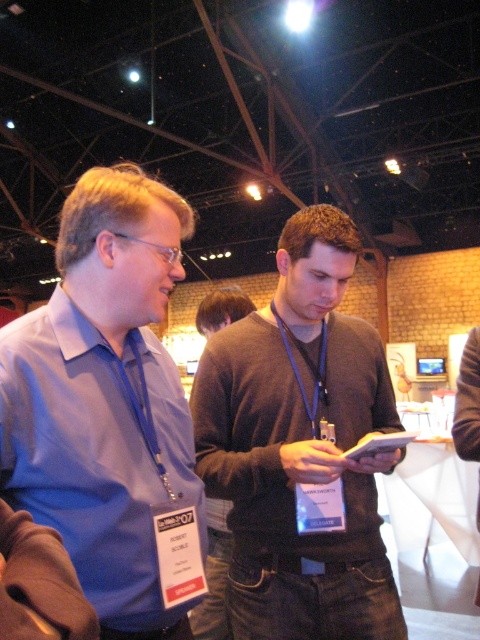
You are organizing a photo shoot and need to arrange two models wearing the matte blue shirt at left and dark gray sweater at center. The requirement is that the taller model should stand behind the shorter one to avoid blocking the view. Which model should be placed where?

The matte blue shirt at left is much taller than the dark gray sweater at center. Therefore, the model wearing the matte blue shirt at left should stand behind the dark gray sweater at center to ensure the shorter model is visible.

Based on the scene description and the coordinates provided, which object corresponds to the point labeled at position (109, 408)?

The point labeled at position (109, 408) corresponds to the matte blue shirt at left.